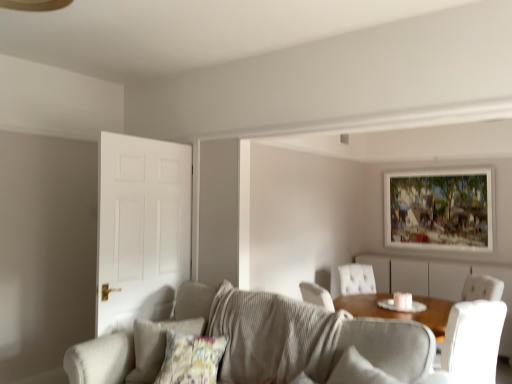
Image resolution: width=512 pixels, height=384 pixels. I want to click on floral fabric pillow at lower left, so click(156, 345).

Where is `white matte door at left`? This screenshot has height=384, width=512. white matte door at left is located at coordinates (141, 229).

Measure the distance between point (414, 359) and camera.

Point (414, 359) is 6.74 feet from camera.

What is the approximate width of wooden-framed painting at upper right?

The width of wooden-framed painting at upper right is 2.56 inches.

Find the location of a particular element. The height and width of the screenshot is (384, 512). wooden dresser at center is located at coordinates (438, 282).

Where is `floral fabric pillow at lower left`? This screenshot has height=384, width=512. floral fabric pillow at lower left is located at coordinates (156, 345).

Is textured gray couch at center completely or partially outside of white leather chair at right?

Yes, textured gray couch at center is located beyond the bounds of white leather chair at right.

Can you confirm if textured gray couch at center is positioned to the right of white leather chair at right?

No.

Looking at this image, is textured gray couch at center taller or shorter than white leather chair at right?

textured gray couch at center is shorter than white leather chair at right.

Based on the photo, which object is more forward, textured gray couch at center or white leather chair at right?

textured gray couch at center is closer to the camera.

How much distance is there between floral fabric pillow at lower left and textured gray couch at center?

A distance of 9.02 inches exists between floral fabric pillow at lower left and textured gray couch at center.

Would you say floral fabric pillow at lower left is a long distance from textured gray couch at center?

No, floral fabric pillow at lower left is not far away from textured gray couch at center.

Would you say floral fabric pillow at lower left is to the left or to the right of textured gray couch at center in the picture?

From the image, it's evident that floral fabric pillow at lower left is to the left of textured gray couch at center.

Between floral fabric pillow at lower left and textured gray couch at center, which one is positioned behind?

Positioned behind is floral fabric pillow at lower left.

From the image's perspective, which is above, floral fabric pillow at lower left or white leather chair at right?

From the image's view, floral fabric pillow at lower left is above.

Does floral fabric pillow at lower left have a greater height compared to white leather chair at right?

In fact, floral fabric pillow at lower left may be shorter than white leather chair at right.

Does point (160, 365) come closer to viewer compared to point (465, 331)?

Yes, it is.

Does floral fabric pillow at lower left have a greater width compared to white leather chair at right?

No, floral fabric pillow at lower left is not wider than white leather chair at right.

Considering the sizes of objects white matte door at left and white leather chair at right in the image provided, who is thinner, white matte door at left or white leather chair at right?

white matte door at left.

Who is shorter, white matte door at left or white leather chair at right?

white leather chair at right.

Looking at this image, which is correct: white matte door at left is inside white leather chair at right, or outside of it?

white matte door at left lies outside white leather chair at right.

Which object is positioned more to the left, white matte door at left or white leather chair at right?

Positioned to the left is white matte door at left.

Is wooden-framed painting at upper right far from wooden dresser at center?

wooden-framed painting at upper right is near wooden dresser at center, not far away.

From the picture: Between wooden-framed painting at upper right and wooden dresser at center, which one has smaller width?

wooden-framed painting at upper right is thinner.

Considering the relative sizes of wooden-framed painting at upper right and wooden dresser at center in the image provided, is wooden-framed painting at upper right bigger than wooden dresser at center?

No.

Who is more distant, wooden-framed painting at upper right or white leather chair at right?

wooden-framed painting at upper right is further away from the camera.

Can you tell me how much wooden-framed painting at upper right and white leather chair at right differ in facing direction?

35.9 degrees.

From a real-world perspective, between wooden-framed painting at upper right and white leather chair at right, who is vertically higher?

wooden-framed painting at upper right.

In terms of width, does wooden-framed painting at upper right look wider or thinner when compared to white leather chair at right?

Clearly, wooden-framed painting at upper right has less width compared to white leather chair at right.

From a real-world perspective, is wooden-framed painting at upper right above or below textured gray couch at center?

In terms of real-world spatial position, wooden-framed painting at upper right is above textured gray couch at center.

Between wooden-framed painting at upper right and textured gray couch at center, which one is positioned behind?

wooden-framed painting at upper right is further away from the camera.

In terms of height, does wooden-framed painting at upper right look taller or shorter compared to textured gray couch at center?

Considering their sizes, wooden-framed painting at upper right has more height than textured gray couch at center.

This screenshot has width=512, height=384. I want to click on studio couch lying on the left of wooden-framed painting at upper right, so click(356, 347).

What are the coordinates of `chair on the right of textured gray couch at center` in the screenshot? It's located at 471,343.

The width and height of the screenshot is (512, 384). In order to click on pillow above the textured gray couch at center (from the image's perspective) in this screenshot , I will do `click(156, 345)`.

Which object lies further to the anchor point floral fabric pillow at lower left, wooden-framed painting at upper right or wooden dresser at center?

Based on the image, wooden-framed painting at upper right appears to be further to floral fabric pillow at lower left.

Considering their positions, is floral fabric pillow at lower left positioned closer to white leather chair at right than wooden-framed painting at upper right?

floral fabric pillow at lower left lies closer to white leather chair at right than the other object.

When comparing their distances from textured gray couch at center, does floral fabric pillow at lower left or wooden dresser at center seem closer?

The object closer to textured gray couch at center is floral fabric pillow at lower left.

From the picture: Which object lies nearer to the anchor point white leather chair at right, wooden dresser at center or wooden-framed painting at upper right?

The object closer to white leather chair at right is wooden dresser at center.

Which object lies further to the anchor point textured gray couch at center, white matte door at left or white leather chair at right?

Among the two, white leather chair at right is located further to textured gray couch at center.

Looking at the image, which one is located further to floral fabric pillow at lower left, wooden dresser at center or wooden-framed painting at upper right?

Based on the image, wooden-framed painting at upper right appears to be further to floral fabric pillow at lower left.

When comparing their distances from white leather chair at right, does wooden-framed painting at upper right or textured gray couch at center seem further?

The object further to white leather chair at right is wooden-framed painting at upper right.

When comparing their distances from wooden-framed painting at upper right, does wooden dresser at center or floral fabric pillow at lower left seem further?

floral fabric pillow at lower left lies further to wooden-framed painting at upper right than the other object.

The height and width of the screenshot is (384, 512). What are the coordinates of `chair between floral fabric pillow at lower left and wooden-framed painting at upper right from left to right` in the screenshot? It's located at (471, 343).

The width and height of the screenshot is (512, 384). I want to click on chair between floral fabric pillow at lower left and wooden dresser at center in the horizontal direction, so click(x=471, y=343).

Where is `dresser between white matte door at left and wooden-framed painting at upper right in the horizontal direction`? dresser between white matte door at left and wooden-framed painting at upper right in the horizontal direction is located at coordinates (438, 282).

The width and height of the screenshot is (512, 384). I want to click on chair between textured gray couch at center and wooden-framed painting at upper right from front to back, so click(x=471, y=343).